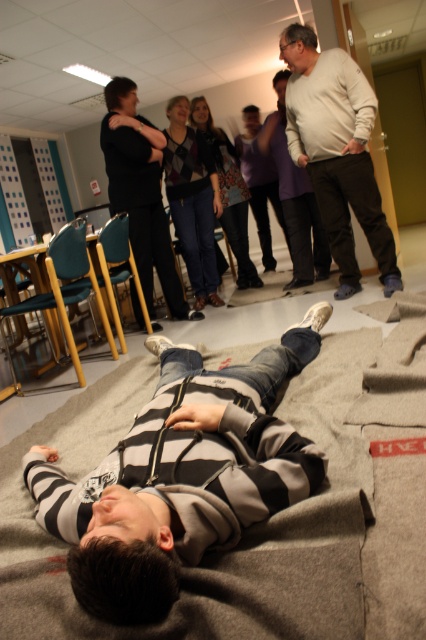
Can you confirm if light gray sweater at upper center is positioned to the left of matte black shirt at center?

No, light gray sweater at upper center is not to the left of matte black shirt at center.

Is point (325, 125) farther from viewer compared to point (132, 161)?

No, (325, 125) is in front of (132, 161).

Is point (313, 76) farther from camera compared to point (149, 230)?

No, it is not.

I want to click on light gray sweater at upper center, so (336, 150).

Who is more distant from viewer, [95,385] or [290,280]?

The point [290,280] is behind.

Does gray woolen blanket at lower center appear under light beige pants at center?

Yes.

Measure the distance between gray woolen blanket at lower center and camera.

gray woolen blanket at lower center is 37.32 inches from camera.

This screenshot has height=640, width=426. I want to click on gray woolen blanket at lower center, so click(x=265, y=520).

Does gray woolen blanket at lower center have a greater height compared to light gray sweater at upper center?

Incorrect, gray woolen blanket at lower center's height is not larger of light gray sweater at upper center's.

Does point (80, 632) lie behind point (385, 268)?

No, it is in front of (385, 268).

Between point (328, 496) and point (331, 252), which one is positioned behind?

The point (331, 252) is behind.

In order to click on gray woolen blanket at lower center in this screenshot , I will do `click(265, 520)`.